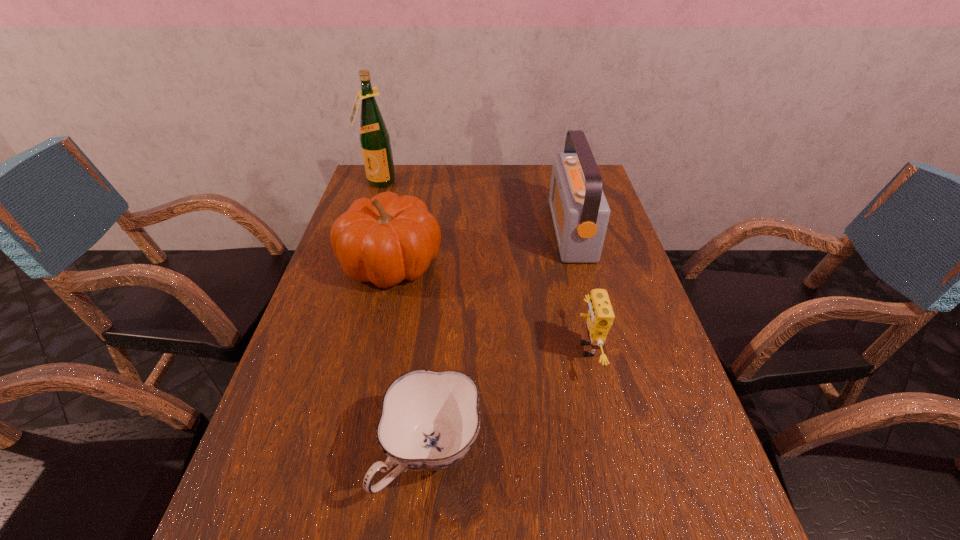
You are a GUI agent. You are given a task and a screenshot of the screen. Output one action in this format:
    pyautogui.click(x=<x>, y=<y>)
    Task: Click on the radio receiver that is at the right edge
    Image resolution: width=960 pixels, height=540 pixels.
    Given the screenshot: What is the action you would take?
    pyautogui.click(x=580, y=212)

Where is `sponge at the right edge`? sponge at the right edge is located at coordinates point(600,316).

At what (x,y) coordinates should I click in order to perform the action: click on object situated at the far left corner. Please return your answer as a coordinate pair (x, y). Looking at the image, I should click on (374, 137).

I want to click on vacant area at the far edge, so click(423, 195).

In the image, there is a desktop. Identify the location of vacant region at the left edge. (348, 414).

The width and height of the screenshot is (960, 540). In the image, there is a desktop. What are the coordinates of `vacant space at the right edge` in the screenshot? It's located at (620, 407).

In the image, there is a desktop. Where is `vacant space at the far left corner`? Image resolution: width=960 pixels, height=540 pixels. vacant space at the far left corner is located at coordinates (406, 174).

Find the location of a particular element. vacant area between the second tallest object and the farthest object is located at coordinates point(475,206).

The width and height of the screenshot is (960, 540). I want to click on unoccupied position between the liquor and the radio receiver, so click(475, 206).

Identify the location of object that is the third closest to the second tallest object. (429, 420).